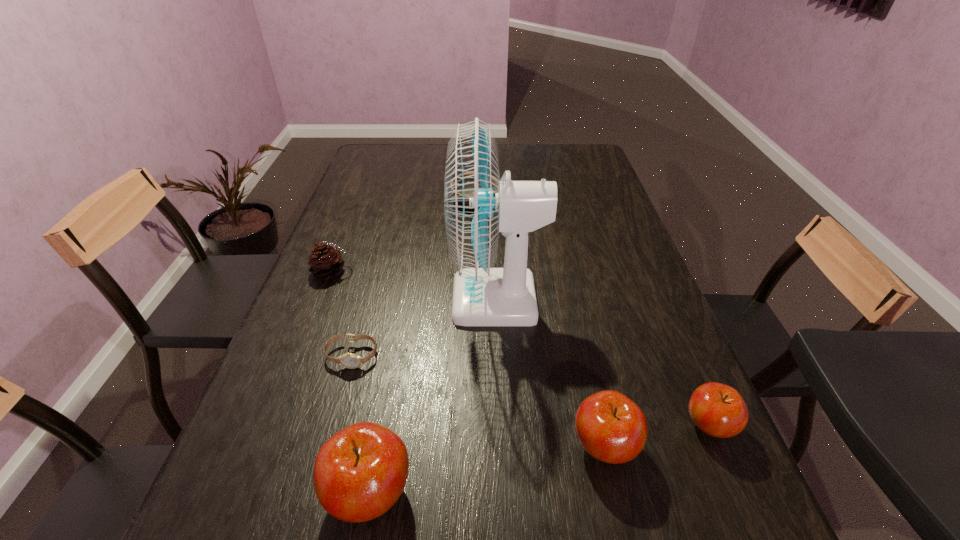
Identify the location of vacant area situated 0.400m on the right of the tallest apple. (646, 492).

Where is `free point located on the right of the second apple from right to left`? free point located on the right of the second apple from right to left is located at coordinates (702, 446).

The width and height of the screenshot is (960, 540). I want to click on free location located on the left of the rightmost apple, so click(595, 426).

Identify the location of free location located 0.260m in front of the fan to face the airflow. (348, 300).

Locate an element on the screen. vacant space located 0.080m in front of the fan to face the airflow is located at coordinates 420,300.

Find the location of a particular element. The image size is (960, 540). blank area located 0.340m in front of the fan to face the airflow is located at coordinates (317, 300).

The height and width of the screenshot is (540, 960). Identify the location of free space located on the face of the watch. (342, 393).

Where is `free spot located with a leaf charm attached to the leftmost object`? This screenshot has height=540, width=960. free spot located with a leaf charm attached to the leftmost object is located at coordinates (452, 272).

What are the coordinates of `watch present at the left edge` in the screenshot? It's located at (348, 360).

Locate an element on the screen. This screenshot has width=960, height=540. pinecone situated at the left edge is located at coordinates (325, 261).